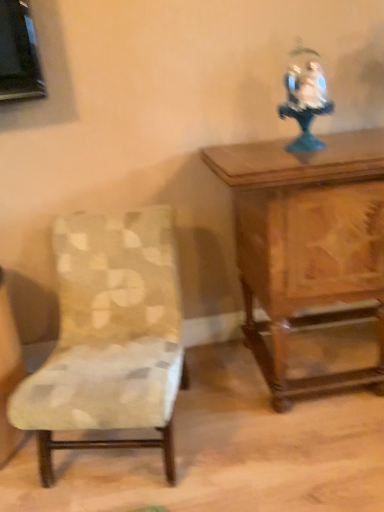
Identify the location of vacant area that lies between wooden carved table at upper right and patterned fabric chair at left. Image resolution: width=384 pixels, height=512 pixels. (240, 424).